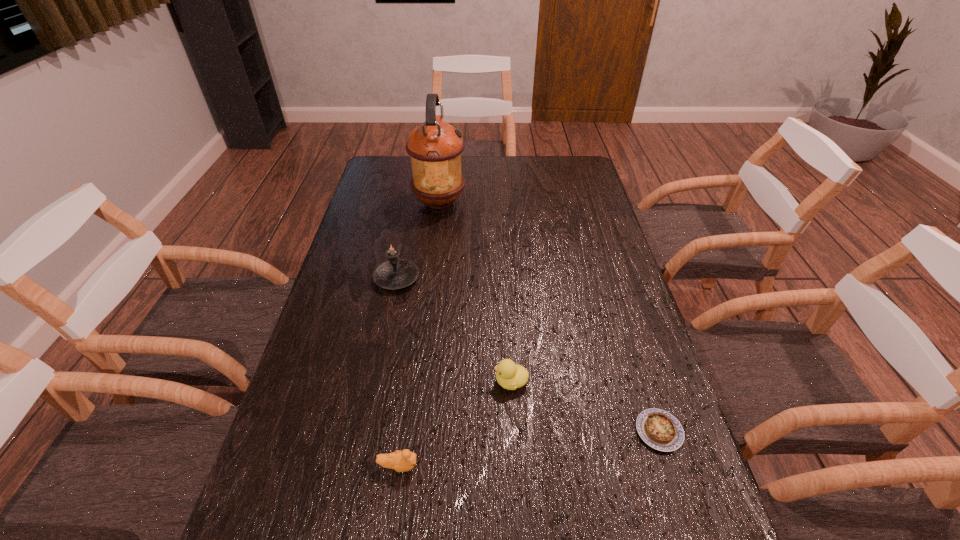
You are a GUI agent. You are given a task and a screenshot of the screen. Output one action in this format:
    pyautogui.click(x=<x>, y=<y>)
    Task: Click on the free space at the right edge of the desktop
    The image size is (960, 540).
    Given the screenshot: What is the action you would take?
    (x=636, y=321)

The height and width of the screenshot is (540, 960). What are the coordinates of `free space at the far right corner of the desktop` in the screenshot? It's located at (554, 161).

The height and width of the screenshot is (540, 960). Identify the location of vacant area that lies between the right duckling and the quiche. click(x=585, y=406).

This screenshot has height=540, width=960. Identify the location of unoccupied area between the farther duckling and the candle. (454, 330).

You are a GUI agent. You are given a task and a screenshot of the screen. Output one action in this format:
    pyautogui.click(x=<x>, y=<y>)
    Task: Click on the vacant point located between the nearest object and the second object from right to left
    The height and width of the screenshot is (540, 960).
    Given the screenshot: What is the action you would take?
    pyautogui.click(x=455, y=423)

In order to click on unoccupied area between the fourth farthest object and the nearer duckling in this screenshot , I will do `click(529, 448)`.

The height and width of the screenshot is (540, 960). I want to click on vacant space that is in between the tallest object and the candle, so click(x=418, y=240).

This screenshot has height=540, width=960. I want to click on free space between the fourth farthest object and the left duckling, so click(x=529, y=448).

I want to click on vacant area that lies between the fourth nearest object and the nearest object, so click(397, 372).

Find the location of a particular element. vacant area between the right duckling and the shorter duckling is located at coordinates (455, 423).